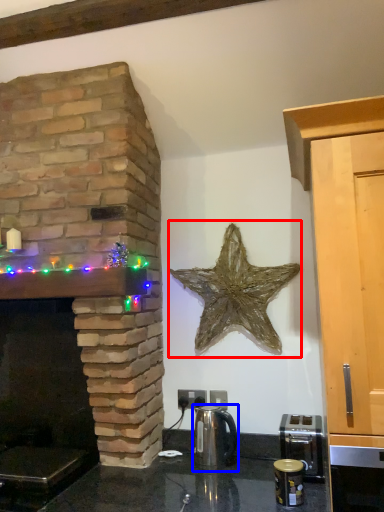
Question: Among these objects, which one is farthest to the camera, starfish (highlighted by a red box) or tea pot (highlighted by a blue box)?

Choices:
 (A) starfish
 (B) tea pot

Answer: (A)